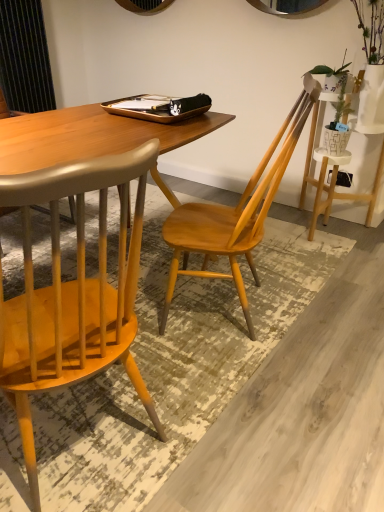
Where is `light wood chair at center, the second chair in the left-to-right sequence`? light wood chair at center, the second chair in the left-to-right sequence is located at coordinates (235, 214).

Image resolution: width=384 pixels, height=512 pixels. What do you see at coordinates (235, 214) in the screenshot? I see `light wood chair at center, the second chair in the left-to-right sequence` at bounding box center [235, 214].

This screenshot has width=384, height=512. Identify the location of wooden chair at left, positioned as the 2th chair in right-to-left order. (72, 292).

Describe the element at coordinates (72, 292) in the screenshot. I see `wooden chair at left, which is counted as the first chair, starting from the left` at that location.

Locate an element on the screen. light wood chair at center, the first chair from the right is located at coordinates (235, 214).

Which is more to the left, light wood chair at center, the first chair from the right, or wooden chair at left, positioned as the 2th chair in right-to-left order?

From the viewer's perspective, wooden chair at left, positioned as the 2th chair in right-to-left order, appears more on the left side.

Which is behind, light wood chair at center, the first chair from the right, or wooden chair at left, positioned as the 2th chair in right-to-left order?

light wood chair at center, the first chair from the right, is more distant.

Which is closer, (238,225) or (119,281)?

The point (119,281) is closer to the camera.

Consider the image. From the image's perspective, who appears lower, light wood chair at center, the first chair from the right, or wooden chair at left, which is counted as the first chair, starting from the left?

wooden chair at left, which is counted as the first chair, starting from the left, is shown below in the image.

From a real-world perspective, relative to wooden chair at left, positioned as the 2th chair in right-to-left order, is light wood chair at center, the first chair from the right, vertically above or below?

Clearly, from a real-world perspective, light wood chair at center, the first chair from the right, is below wooden chair at left, positioned as the 2th chair in right-to-left order.

Considering the relative sizes of light wood chair at center, the second chair in the left-to-right sequence, and wooden chair at left, positioned as the 2th chair in right-to-left order, in the image provided, is light wood chair at center, the second chair in the left-to-right sequence, wider than wooden chair at left, positioned as the 2th chair in right-to-left order,?

In fact, light wood chair at center, the second chair in the left-to-right sequence, might be narrower than wooden chair at left, positioned as the 2th chair in right-to-left order.

Which of these two, light wood chair at center, the second chair in the left-to-right sequence, or wooden chair at left, which is counted as the first chair, starting from the left, stands shorter?

With less height is wooden chair at left, which is counted as the first chair, starting from the left.

Can you confirm if light wood chair at center, the second chair in the left-to-right sequence, is smaller than wooden chair at left, positioned as the 2th chair in right-to-left order?

Correct, light wood chair at center, the second chair in the left-to-right sequence, occupies less space than wooden chair at left, positioned as the 2th chair in right-to-left order.

Is light wood chair at center, the second chair in the left-to-right sequence, completely or partially outside of wooden chair at left, positioned as the 2th chair in right-to-left order?

That's correct, light wood chair at center, the second chair in the left-to-right sequence, is outside of wooden chair at left, positioned as the 2th chair in right-to-left order.

Is light wood chair at center, the second chair in the left-to-right sequence, turned away from wooden chair at left, which is counted as the first chair, starting from the left?

No, light wood chair at center, the second chair in the left-to-right sequence,'s orientation is not away from wooden chair at left, which is counted as the first chair, starting from the left.

Can you tell me how much light wood chair at center, the second chair in the left-to-right sequence, and wooden chair at left, positioned as the 2th chair in right-to-left order, differ in facing direction?

The angle between the facing direction of light wood chair at center, the second chair in the left-to-right sequence, and the facing direction of wooden chair at left, positioned as the 2th chair in right-to-left order, is 35.4 degrees.

Measure the distance from light wood chair at center, the first chair from the right, to wooden chair at left, positioned as the 2th chair in right-to-left order.

62.41 centimeters.

Where is `chair below the light wood chair at center, the second chair in the left-to-right sequence (from the image's perspective)`? This screenshot has width=384, height=512. chair below the light wood chair at center, the second chair in the left-to-right sequence (from the image's perspective) is located at coordinates (72, 292).

Considering the relative positions of wooden chair at left, which is counted as the first chair, starting from the left, and light wood chair at center, the first chair from the right, in the image provided, is wooden chair at left, which is counted as the first chair, starting from the left, to the right of light wood chair at center, the first chair from the right, from the viewer's perspective?

Incorrect, wooden chair at left, which is counted as the first chair, starting from the left, is not on the right side of light wood chair at center, the first chair from the right.

Who is more distant, wooden chair at left, positioned as the 2th chair in right-to-left order, or light wood chair at center, the first chair from the right?

light wood chair at center, the first chair from the right.

Which is further, (123, 194) or (175, 268)?

The point (175, 268) is farther from the camera.

From the image's perspective, does wooden chair at left, positioned as the 2th chair in right-to-left order, appear lower than light wood chair at center, the second chair in the left-to-right sequence?

Yes.

From a real-world perspective, is wooden chair at left, positioned as the 2th chair in right-to-left order, on light wood chair at center, the second chair in the left-to-right sequence?

Indeed, from a real-world perspective, wooden chair at left, positioned as the 2th chair in right-to-left order, stands above light wood chair at center, the second chair in the left-to-right sequence.

Considering the sizes of objects wooden chair at left, positioned as the 2th chair in right-to-left order, and light wood chair at center, the second chair in the left-to-right sequence, in the image provided, who is thinner, wooden chair at left, positioned as the 2th chair in right-to-left order, or light wood chair at center, the second chair in the left-to-right sequence,?

Thinner between the two is light wood chair at center, the second chair in the left-to-right sequence.

Can you confirm if wooden chair at left, which is counted as the first chair, starting from the left, is shorter than light wood chair at center, the second chair in the left-to-right sequence?

Yes, wooden chair at left, which is counted as the first chair, starting from the left, is shorter than light wood chair at center, the second chair in the left-to-right sequence.

In terms of size, does wooden chair at left, which is counted as the first chair, starting from the left, appear bigger or smaller than light wood chair at center, the first chair from the right?

wooden chair at left, which is counted as the first chair, starting from the left, is bigger than light wood chair at center, the first chair from the right.

Based on the photo, is wooden chair at left, which is counted as the first chair, starting from the left, outside of light wood chair at center, the first chair from the right?

Yes.

Is wooden chair at left, positioned as the 2th chair in right-to-left order, next to light wood chair at center, the first chair from the right, and touching it?

No, wooden chair at left, positioned as the 2th chair in right-to-left order, is not touching light wood chair at center, the first chair from the right.

Could you tell me if wooden chair at left, positioned as the 2th chair in right-to-left order, is facing light wood chair at center, the second chair in the left-to-right sequence?

No, wooden chair at left, positioned as the 2th chair in right-to-left order, is not oriented towards light wood chair at center, the second chair in the left-to-right sequence.

From the picture: How different are the orientations of wooden chair at left, which is counted as the first chair, starting from the left, and light wood chair at center, the first chair from the right, in degrees?

35.4 degrees.

Image resolution: width=384 pixels, height=512 pixels. Identify the location of chair behind the wooden chair at left, positioned as the 2th chair in right-to-left order. (235, 214).

Locate an element on the screen. The width and height of the screenshot is (384, 512). chair located in front of the light wood chair at center, the second chair in the left-to-right sequence is located at coordinates (72, 292).

Identify the location of chair lying behind the wooden chair at left, positioned as the 2th chair in right-to-left order. (235, 214).